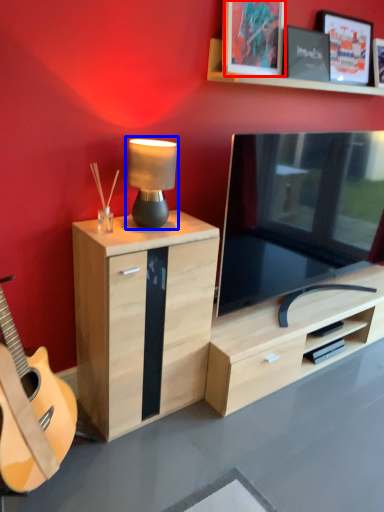
Question: Which object appears farthest to the camera in this image, picture frame (highlighted by a red box) or table lamp (highlighted by a blue box)?

Choices:
 (A) picture frame
 (B) table lamp

Answer: (A)